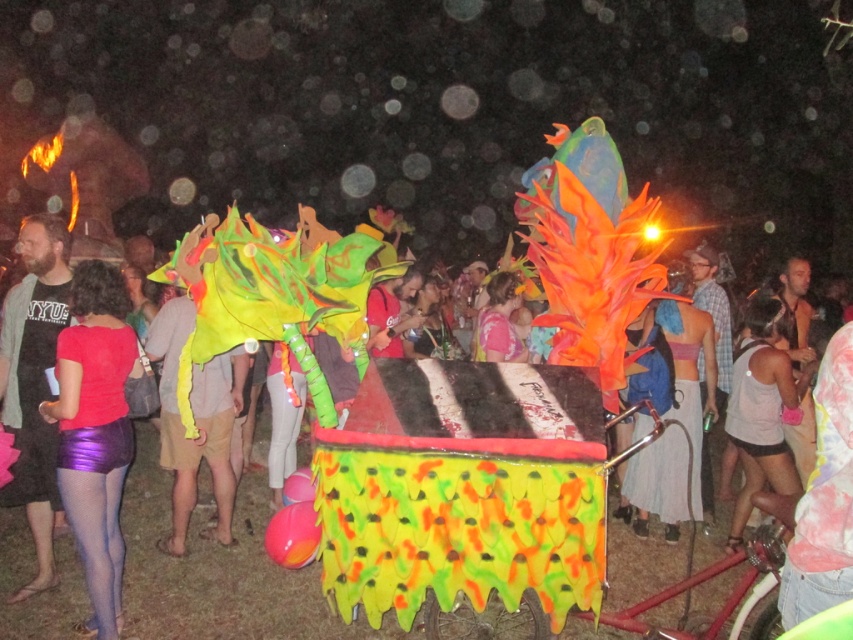
Question: Which object appears closest to the camera in this image?

Choices:
 (A) white tank top at center
 (B) neon yellow fabric at center
 (C) purple shiny shorts at lower left
 (D) matte black shirt at left

Answer: (C)

Question: Among these objects, which one is nearest to the camera?

Choices:
 (A) neon yellow fabric at center
 (B) white tank top at center

Answer: (A)

Question: From the image, what is the correct spatial relationship of purple shiny shorts at lower left in relation to matte black shirt at left?

Choices:
 (A) right
 (B) left

Answer: (A)

Question: Is neon yellow fabric at center positioned behind white tank top at center?

Choices:
 (A) yes
 (B) no

Answer: (B)

Question: Can you confirm if purple shiny shorts at lower left is bigger than neon yellow fabric at center?

Choices:
 (A) yes
 (B) no

Answer: (B)

Question: Which object is farther from the camera taking this photo?

Choices:
 (A) white tank top at center
 (B) matte black shirt at left
 (C) neon yellow fabric at center

Answer: (A)